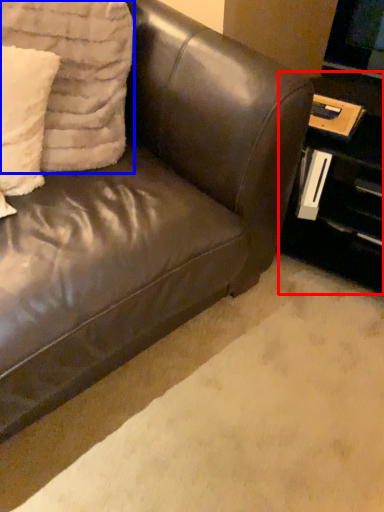
Question: Which of the following is the closest to the observer, table (highlighted by a red box) or pillow (highlighted by a blue box)?

Choices:
 (A) table
 (B) pillow

Answer: (B)